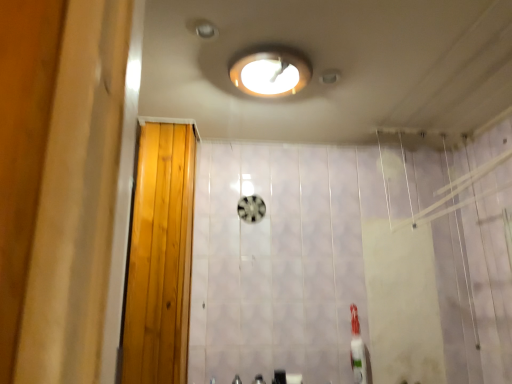
Question: Would you say metallic silver faucet at lower center, the 1th faucet positioned from the left, is to the left or to the right of satin nickel faucet at lower center, the first faucet viewed from the right, in the picture?

Choices:
 (A) right
 (B) left

Answer: (B)

Question: Looking at their shapes, would you say metallic silver faucet at lower center, the 1th faucet positioned from the left, is wider or thinner than satin nickel faucet at lower center, the first faucet viewed from the right?

Choices:
 (A) thin
 (B) wide

Answer: (A)

Question: Which object is the farthest from the metallic silver faucet at lower center, the 1th faucet positioned from the left?

Choices:
 (A) wooden door at left
 (B) matte white light fixture at upper center
 (C) white matte toilet paper at lower center
 (D) white glossy toothbrush at lower right
 (E) satin nickel faucet at lower center, the first faucet viewed from the right

Answer: (B)

Question: Based on their relative distances, which object is nearer to the metallic silver faucet at lower center, the 1th faucet positioned from the left?

Choices:
 (A) satin nickel faucet at lower center, the first faucet viewed from the right
 (B) matte white light fixture at upper center
 (C) wooden door at left
 (D) white matte toilet paper at lower center
 (E) white glossy toothbrush at lower right

Answer: (A)